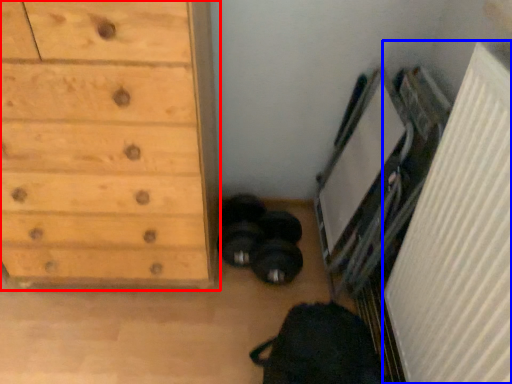
Question: Which object is further to the camera taking this photo, chest of drawers (highlighted by a red box) or radiator (highlighted by a blue box)?

Choices:
 (A) chest of drawers
 (B) radiator

Answer: (A)